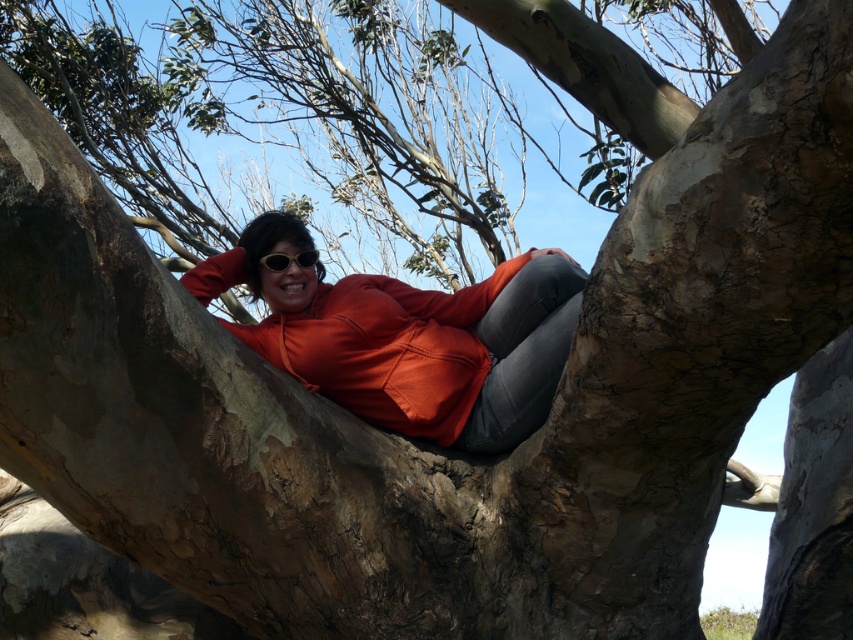
You are a photographer trying to capture the person in the scene. You want to ensure that both the matte orange sweatshirt at center and the sunglasses at center are visible in your shot. Based on their positions, which object should you focus on first to frame the shot properly?

The matte orange sweatshirt at center is positioned on the right side of sunglasses at center. To frame the shot properly, focus on the sunglasses at center first since it is on the left, then include the matte orange sweatshirt at center on the right to ensure both are visible.

You are a photographer trying to capture the person in the image wearing a vibrant red hoodie. You want to focus on the exact point at coordinates point (410, 339). What object is located at this point?

The point (410, 339) corresponds to the matte orange sweatshirt at center.